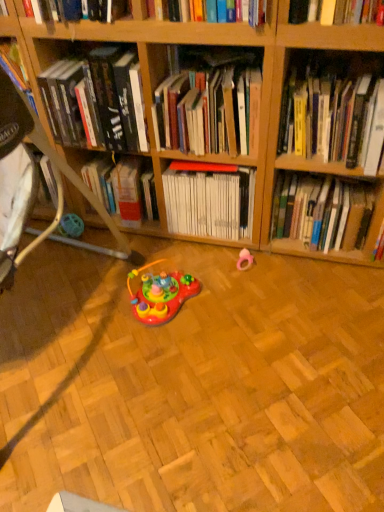
Where is `vacant space in between shiny plastic toy at center, which is the first toy in left-to-right order, and pink rubber ring at center, which is the first toy in right-to-left order`? The height and width of the screenshot is (512, 384). vacant space in between shiny plastic toy at center, which is the first toy in left-to-right order, and pink rubber ring at center, which is the first toy in right-to-left order is located at coordinates (215, 282).